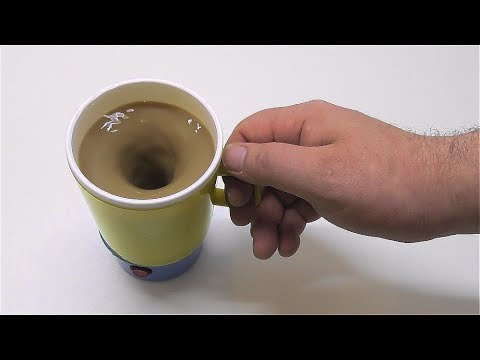
I want to click on cup, so click(168, 245).